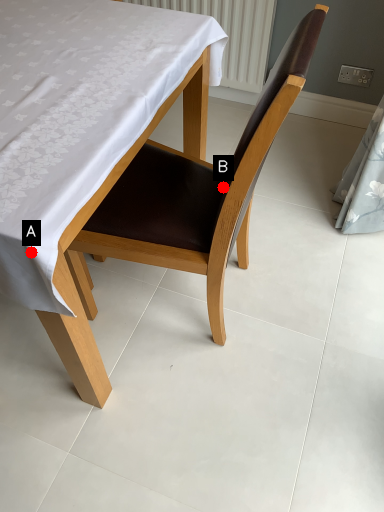
Question: Two points are circled on the image, labeled by A and B beside each circle. Which point is further to the camera?

Choices:
 (A) A is further
 (B) B is further

Answer: (B)